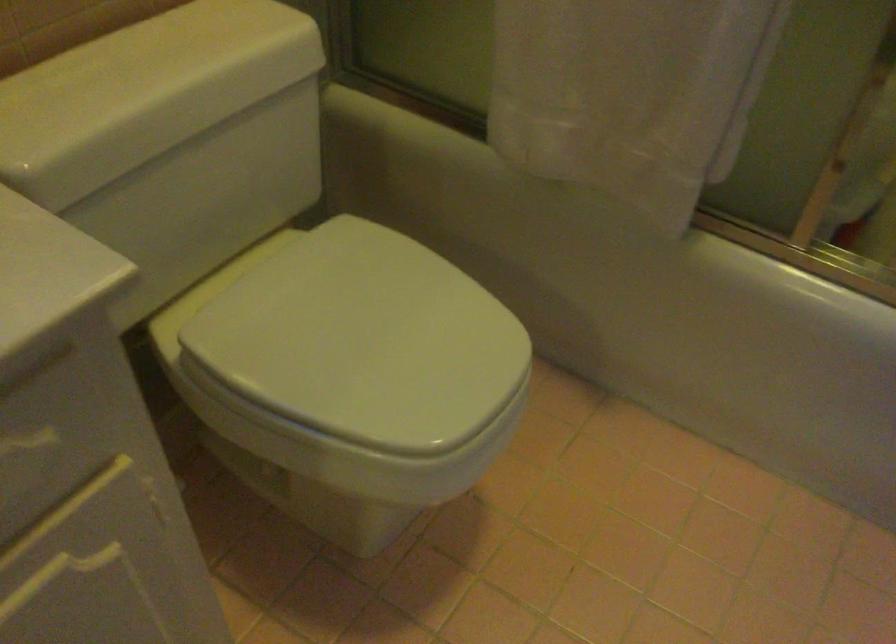
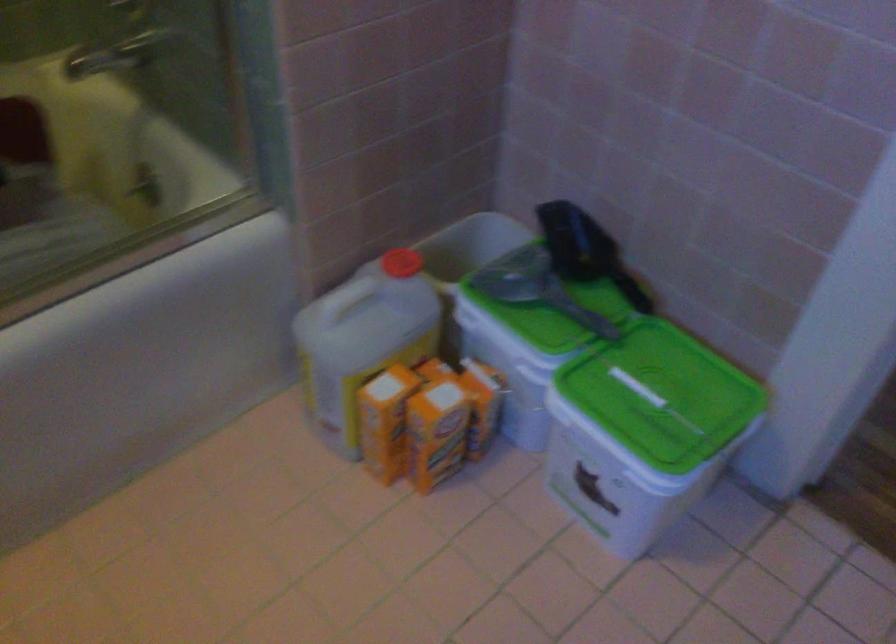
First-person continuous shooting, in which direction is the camera rotating?

The camera rotated toward right-down.